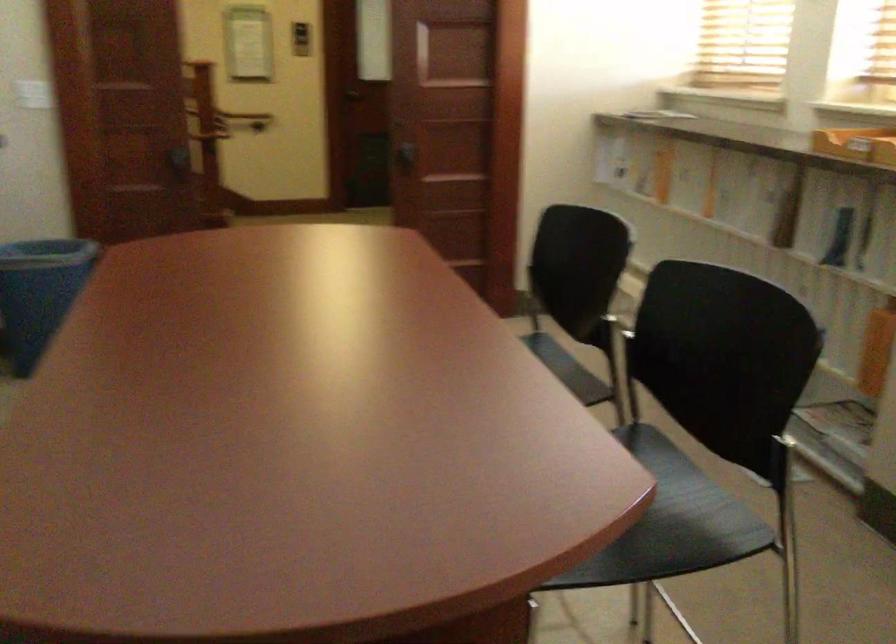
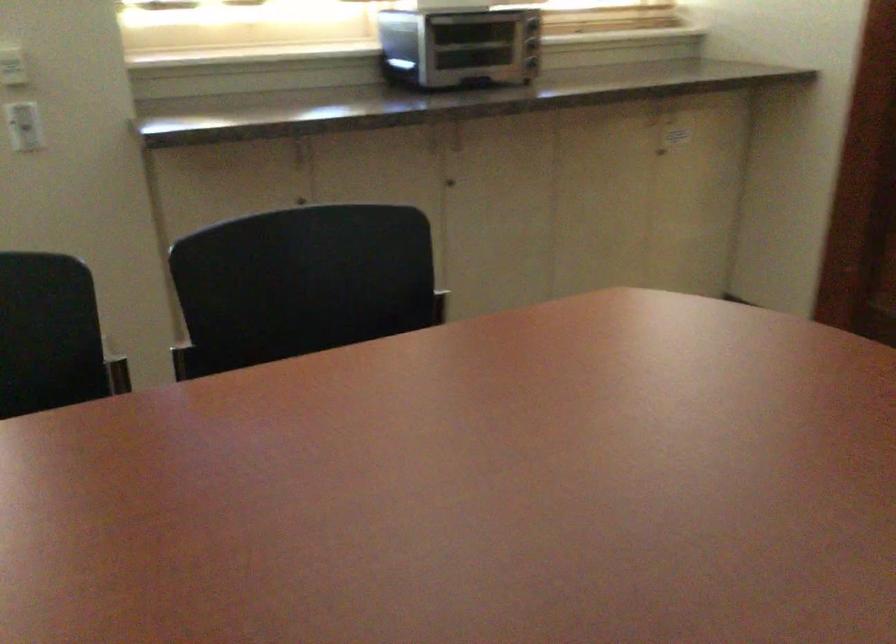
Question: I am providing you with two images of the same scene from different viewpoints. Which of the following objects are not visible in image2?

Choices:
 (A) toaster oven handle
 (B) blue wire bin
 (C) white light switch
 (D) black chair sitting surface

Answer: (D)